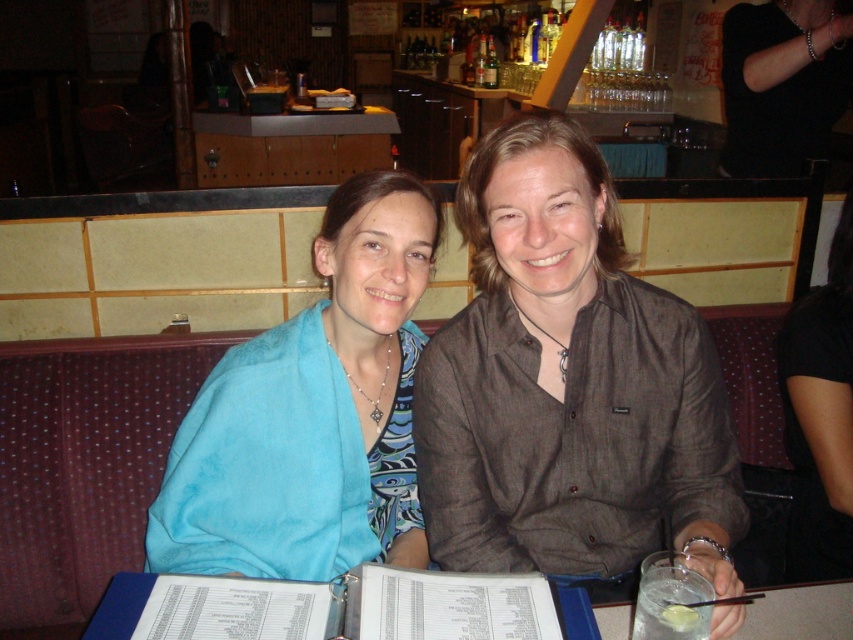
Which of these two, brown textured shirt at center or black matte shirt at upper center, stands taller?

black matte shirt at upper center is taller.

Locate an element on the screen. The width and height of the screenshot is (853, 640). brown textured shirt at center is located at coordinates (567, 384).

Is the position of white paper menu at center more distant than that of black leather arm at upper right?

That is False.

Can you confirm if white paper menu at center is positioned to the right of black leather arm at upper right?

Incorrect, white paper menu at center is not on the right side of black leather arm at upper right.

I want to click on white paper menu at center, so (352, 608).

Is white paper menu at center to the left of black matte shirt at upper center from the viewer's perspective?

Correct, you'll find white paper menu at center to the left of black matte shirt at upper center.

Which is in front, point (354, 570) or point (784, 371)?

Point (354, 570)

Where is `white paper menu at center`? white paper menu at center is located at coordinates (352, 608).